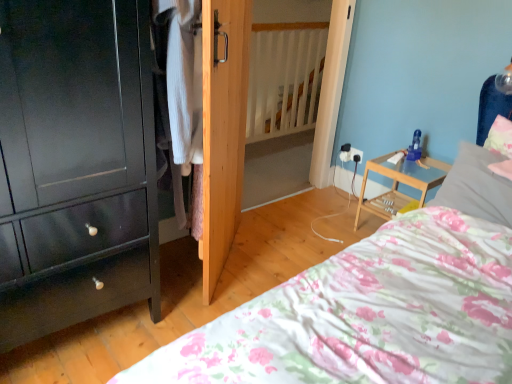
The width and height of the screenshot is (512, 384). What are the coordinates of `spots to the right of blue plastic toy at upper right` in the screenshot? It's located at (433, 156).